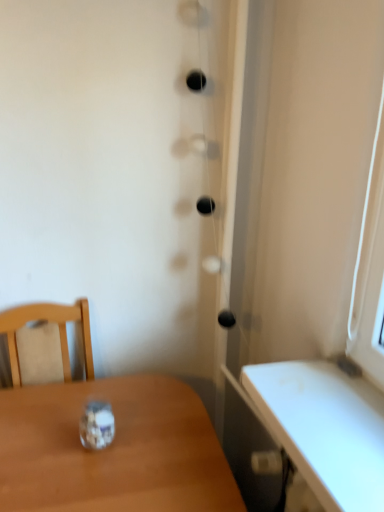
You are a GUI agent. You are given a task and a screenshot of the screen. Output one action in this format:
    pyautogui.click(x=<x>, y=<y>)
    Task: Click on the unoccupied region to the right of clear glass jar at center
    The height and width of the screenshot is (512, 384).
    Given the screenshot: What is the action you would take?
    pyautogui.click(x=151, y=460)